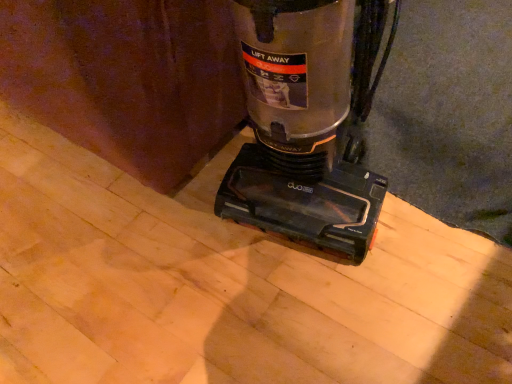
Locate an element on the screen. free location in front of metallic vacuum cleaner at center is located at coordinates (338, 316).